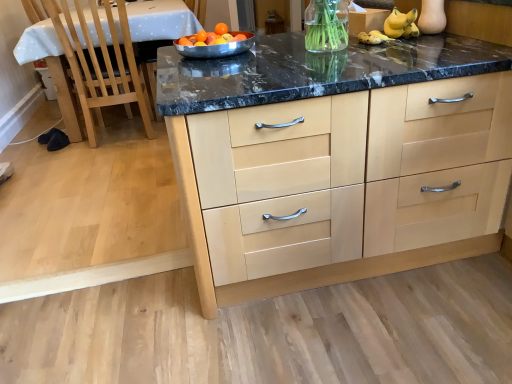
This screenshot has height=384, width=512. What do you see at coordinates (217, 48) in the screenshot?
I see `stainless steel bowl at center` at bounding box center [217, 48].

Identify the location of white glossy table at left. This screenshot has height=384, width=512. (51, 70).

Is orange matte at center bigger or smaller than stainless steel bowl at center?

orange matte at center is smaller than stainless steel bowl at center.

Which point is more forward, (221, 35) or (250, 42)?

The point (250, 42) is more forward.

This screenshot has height=384, width=512. Find the location of `fruit located above the stainless steel bowl at center (from the image's perspective)`. fruit located above the stainless steel bowl at center (from the image's perspective) is located at coordinates (221, 29).

Looking at this image, does orange matte at center lie in front of stainless steel bowl at center?

No.

From a real-world perspective, is white glossy table at left above or below stainless steel bowl at center?

white glossy table at left is below stainless steel bowl at center.

In the scene shown: Can you see white glossy table at left touching stainless steel bowl at center?

No.

Which is behind, point (75, 125) or point (209, 51)?

The point (75, 125) is farther.

The width and height of the screenshot is (512, 384). Find the location of `bowl that is above the white glossy table at left (from a real-world perspective)`. bowl that is above the white glossy table at left (from a real-world perspective) is located at coordinates (217, 48).

Is light wood cabinetry at center far away from white glossy table at left?

Yes, light wood cabinetry at center is far from white glossy table at left.

Who is bigger, light wood cabinetry at center or white glossy table at left?

white glossy table at left.

Considering the relative sizes of light wood cabinetry at center and white glossy table at left in the image provided, is light wood cabinetry at center taller than white glossy table at left?

No.

Is the depth of light wood cabinetry at center greater than that of white glossy table at left?

No, it is in front of white glossy table at left.

Does stainless steel bowl at center turn towards white glossy table at left?

No, stainless steel bowl at center is not oriented towards white glossy table at left.

Where is `bowl located in front of the white glossy table at left`? bowl located in front of the white glossy table at left is located at coordinates (217, 48).

From the picture: Is stainless steel bowl at center wider or thinner than white glossy table at left?

In the image, stainless steel bowl at center appears to be more narrow than white glossy table at left.

Is light wood cabinetry at center smaller than orange matte at center?

Actually, light wood cabinetry at center might be larger than orange matte at center.

From the image's perspective, which one is positioned higher, light wood cabinetry at center or orange matte at center?

orange matte at center, from the image's perspective.

Is light wood cabinetry at center placed right next to orange matte at center?

They are not placed beside each other.

From a real-world perspective, is light wood cabinetry at center above or below orange matte at center?

From a real-world perspective, light wood cabinetry at center is physically below orange matte at center.

Is stainless steel bowl at center bigger than orange matte at center?

Yes.

Looking at this image, considering the relative positions of stainless steel bowl at center and orange matte at center in the image provided, is stainless steel bowl at center to the left of orange matte at center from the viewer's perspective?

Correct, you'll find stainless steel bowl at center to the left of orange matte at center.

Considering the positions of objects stainless steel bowl at center and orange matte at center in the image provided, who is in front, stainless steel bowl at center or orange matte at center?

stainless steel bowl at center is in front.

Which of these two, stainless steel bowl at center or orange matte at center, is thinner?

Thinner between the two is orange matte at center.

Do you think orange matte at center is within white glossy table at left, or outside of it?

orange matte at center is spatially situated outside white glossy table at left.

Does orange matte at center turn towards white glossy table at left?

No, orange matte at center does not turn towards white glossy table at left.

How many degrees apart are the facing directions of orange matte at center and white glossy table at left?

1.6 degrees separate the facing orientations of orange matte at center and white glossy table at left.

From the image's perspective, between orange matte at center and white glossy table at left, who is located below?

orange matte at center appears lower in the image.

Locate an element on the screen. fruit above the stainless steel bowl at center (from a real-world perspective) is located at coordinates (221, 29).

Locate an element on the screen. table below the stainless steel bowl at center (from a real-world perspective) is located at coordinates (51, 70).

Based on their spatial positions, is light wood cabinetry at center or orange matte at center further from stainless steel bowl at center?

light wood cabinetry at center is further to stainless steel bowl at center.

Based on their spatial positions, is orange matte at center or light wood cabinetry at center closer to white glossy table at left?

The object closer to white glossy table at left is orange matte at center.

When comparing their distances from orange matte at center, does stainless steel bowl at center or white glossy table at left seem closer?

Based on the image, stainless steel bowl at center appears to be nearer to orange matte at center.

In the scene shown: Estimate the real-world distances between objects in this image. Which object is further from white glossy table at left, stainless steel bowl at center or light wood cabinetry at center?

light wood cabinetry at center lies further to white glossy table at left than the other object.

When comparing their distances from white glossy table at left, does orange matte at center or stainless steel bowl at center seem further?

stainless steel bowl at center lies further to white glossy table at left than the other object.

Based on their spatial positions, is light wood cabinetry at center or white glossy table at left further from orange matte at center?

white glossy table at left is positioned further to the anchor orange matte at center.

Based on their spatial positions, is stainless steel bowl at center or orange matte at center closer to white glossy table at left?

orange matte at center lies closer to white glossy table at left than the other object.

From the picture: Looking at the image, which one is located closer to stainless steel bowl at center, light wood cabinetry at center or white glossy table at left?

light wood cabinetry at center is positioned closer to the anchor stainless steel bowl at center.

Find the location of a particular element. This screenshot has width=512, height=384. bowl positioned between light wood cabinetry at center and white glossy table at left from near to far is located at coordinates (217, 48).

Where is `bowl between light wood cabinetry at center and orange matte at center along the z-axis`? The height and width of the screenshot is (384, 512). bowl between light wood cabinetry at center and orange matte at center along the z-axis is located at coordinates (217, 48).

Identify the location of fruit between light wood cabinetry at center and white glossy table at left from front to back. This screenshot has width=512, height=384. (221, 29).

Where is `fruit between stainless steel bowl at center and white glossy table at left from front to back`? fruit between stainless steel bowl at center and white glossy table at left from front to back is located at coordinates point(221,29).